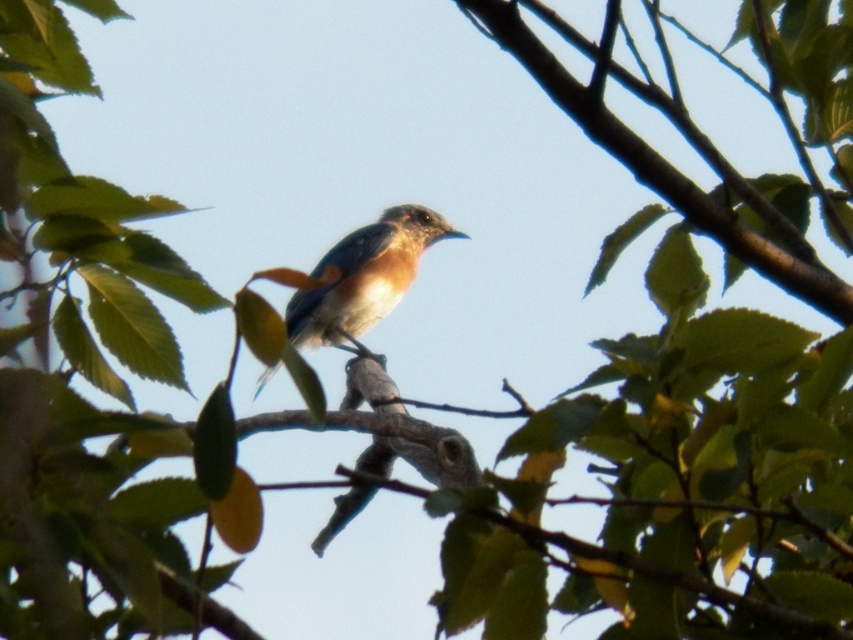
Question: Which of the following is the farthest from the observer?

Choices:
 (A) blue glossy bird at center
 (B) brown wood tree branch at center

Answer: (A)

Question: Does brown wood tree branch at center have a lesser width compared to blue glossy bird at center?

Choices:
 (A) no
 (B) yes

Answer: (B)

Question: Is brown wood tree branch at center thinner than blue glossy bird at center?

Choices:
 (A) yes
 (B) no

Answer: (A)

Question: Which point is farther to the camera?

Choices:
 (A) brown wood tree branch at center
 (B) blue glossy bird at center

Answer: (B)

Question: Can you confirm if brown wood tree branch at center is positioned above blue glossy bird at center?

Choices:
 (A) no
 (B) yes

Answer: (B)